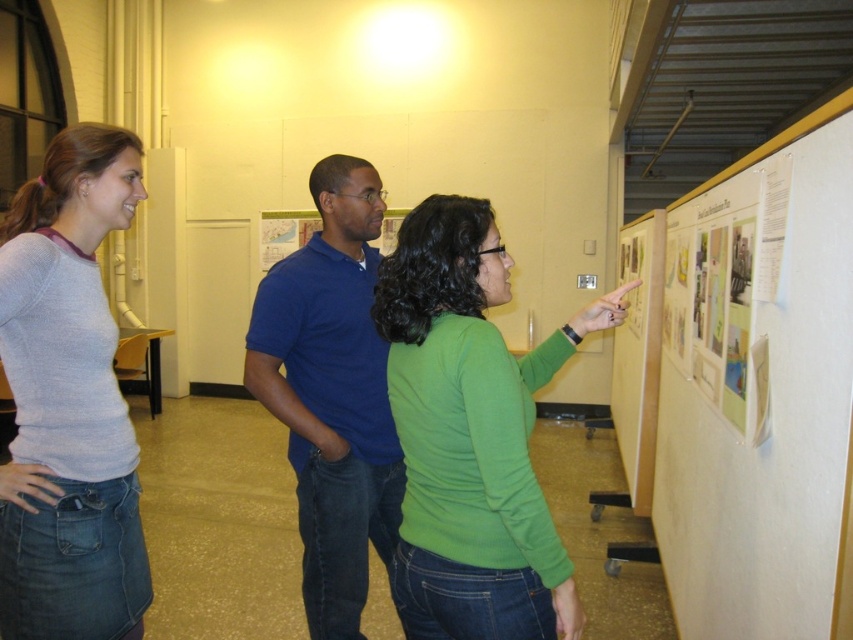
Which is behind, point (694, 316) or point (82, 324)?

Positioned behind is point (694, 316).

Is white paperboard at upper right to the right of light gray sweater at center from the viewer's perspective?

Indeed, white paperboard at upper right is positioned on the right side of light gray sweater at center.

What are the coordinates of `white paperboard at upper right` in the screenshot? It's located at coord(758,388).

The image size is (853, 640). Identify the location of green matte shirt at upper right. (471, 435).

Between green matte shirt at upper right and green matte poster at upper right, which one appears on the right side from the viewer's perspective?

green matte poster at upper right is more to the right.

Describe the element at coordinates (471, 435) in the screenshot. I see `green matte shirt at upper right` at that location.

You are a GUI agent. You are given a task and a screenshot of the screen. Output one action in this format:
    pyautogui.click(x=<x>, y=<y>)
    Task: Click on the green matte shirt at upper right
    Image resolution: width=853 pixels, height=640 pixels.
    Given the screenshot: What is the action you would take?
    pyautogui.click(x=471, y=435)

Based on the photo, between green matte shirt at upper right and blue cotton shirt at center, which one appears on the left side from the viewer's perspective?

blue cotton shirt at center

The height and width of the screenshot is (640, 853). What do you see at coordinates (471, 435) in the screenshot?
I see `green matte shirt at upper right` at bounding box center [471, 435].

The image size is (853, 640). What do you see at coordinates (471, 435) in the screenshot?
I see `green matte shirt at upper right` at bounding box center [471, 435].

Find the location of `green matte shirt at upper right`. green matte shirt at upper right is located at coordinates (471, 435).